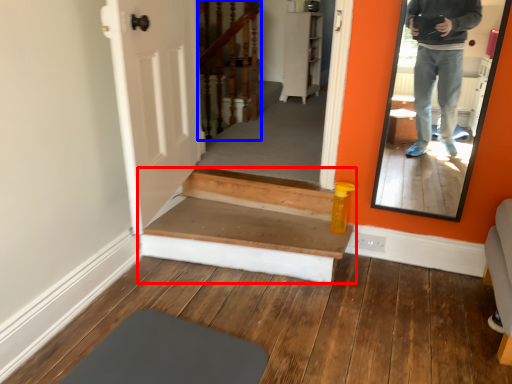
Question: Which object is closer to the camera taking this photo, stairs (highlighted by a red box) or stairwell (highlighted by a blue box)?

Choices:
 (A) stairs
 (B) stairwell

Answer: (A)